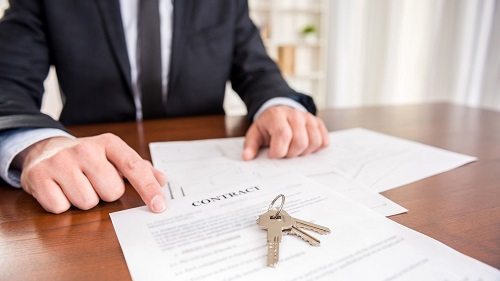
The width and height of the screenshot is (500, 281). Find the location of `papers`. papers is located at coordinates (182, 233), (198, 185), (182, 179), (183, 161), (185, 147), (383, 157).